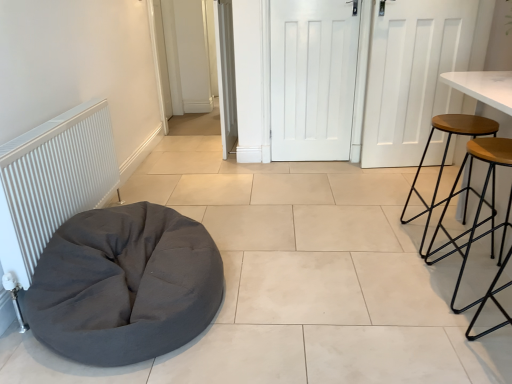
The width and height of the screenshot is (512, 384). Find the location of `blank area to the left of white matte door at center, positioned as the 2th door in left-to-right order`. blank area to the left of white matte door at center, positioned as the 2th door in left-to-right order is located at coordinates (272, 167).